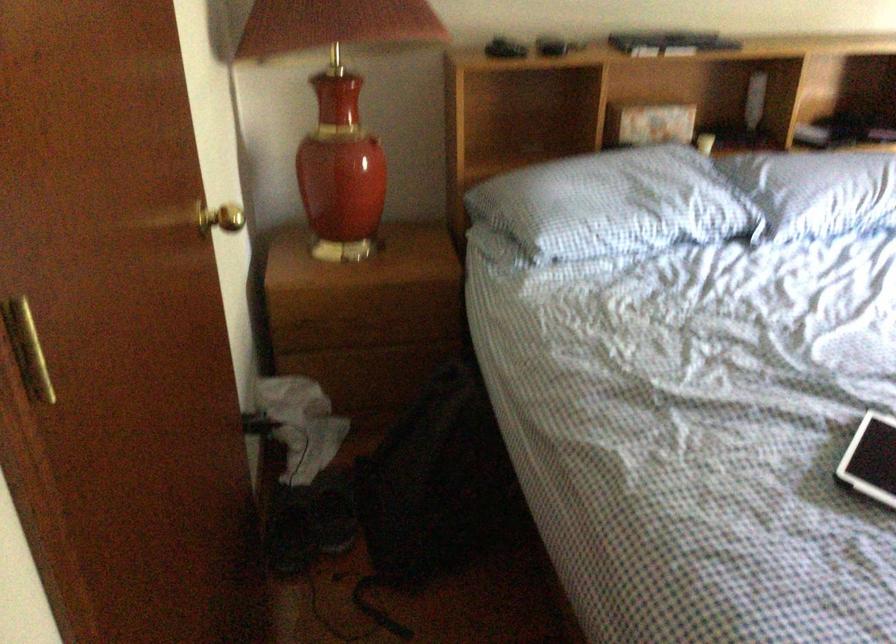
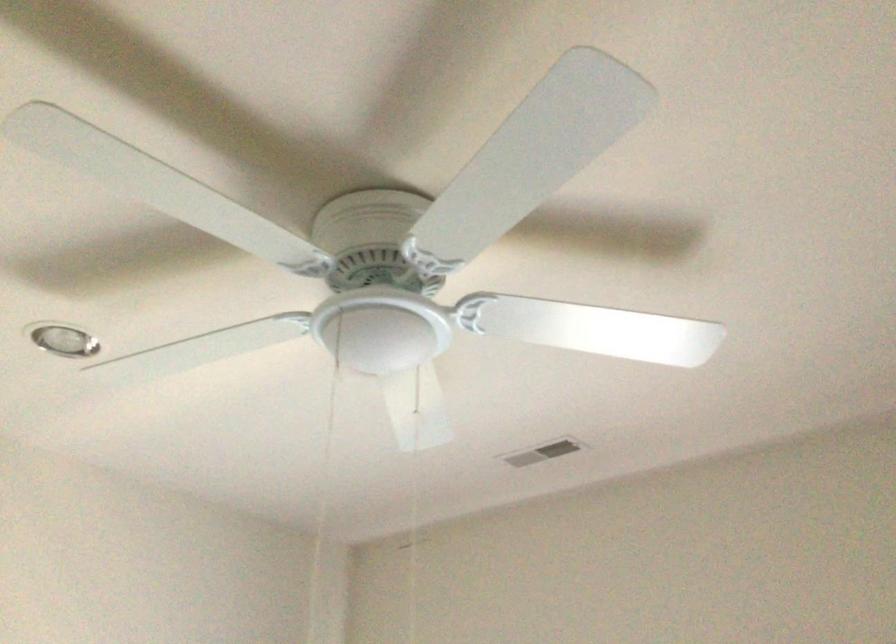
How did the camera likely rotate?

The rotation direction of the camera is right-up.